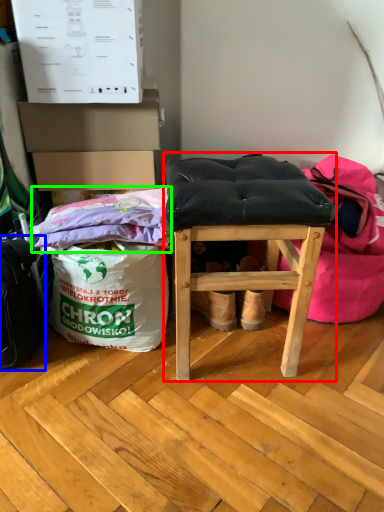
Question: Which is nearer to the furniture (highlighted by a red box)? messenger bag (highlighted by a blue box) or material (highlighted by a green box).

Choices:
 (A) messenger bag
 (B) material

Answer: (B)